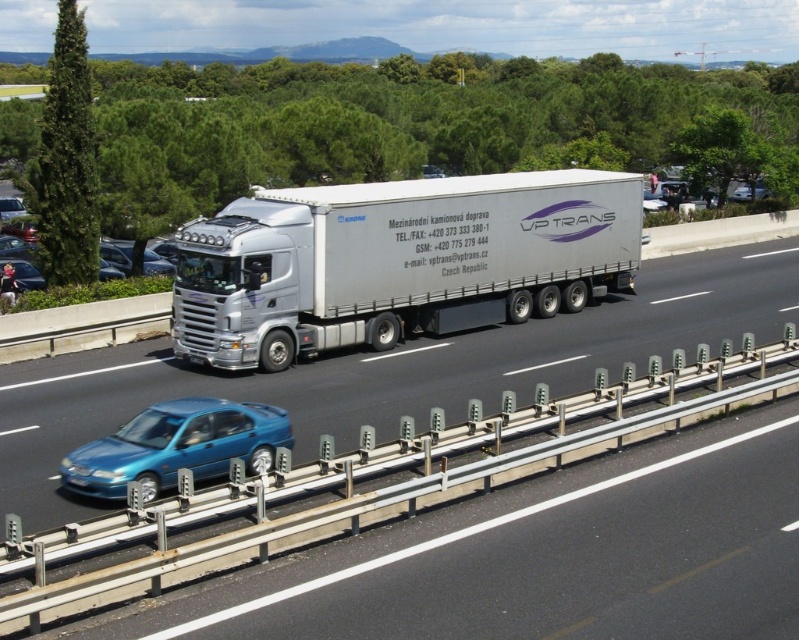
Does point (503, 284) come behind point (235, 435)?

Yes, it is.

Can you confirm if white metallic trailer truck at center is shorter than metallic blue sedan at lower left?

No, white metallic trailer truck at center is not shorter than metallic blue sedan at lower left.

Which is in front, point (382, 342) or point (209, 401)?

Point (209, 401) is in front.

Image resolution: width=799 pixels, height=640 pixels. Find the location of `white metallic trailer truck at center`. white metallic trailer truck at center is located at coordinates (396, 260).

Who is more distant from viewer, [454,346] or [104,291]?

The point [104,291] is more distant.

How distant is white metallic truck at center from metallic blue sedan at left?

The distance of white metallic truck at center from metallic blue sedan at left is 10.11 meters.

Between point (758, 273) and point (141, 285), which one is positioned in front?

Positioned in front is point (141, 285).

Find the location of a particular element. The height and width of the screenshot is (640, 799). white metallic truck at center is located at coordinates (396, 369).

Is point (245, 406) less distant than point (32, 268)?

Yes, point (245, 406) is in front of point (32, 268).

Can you confirm if metallic blue sedan at lower left is positioned above metallic blue sedan at left?

No.

Image resolution: width=799 pixels, height=640 pixels. In order to click on metallic blue sedan at lower left in this screenshot , I will do `click(177, 445)`.